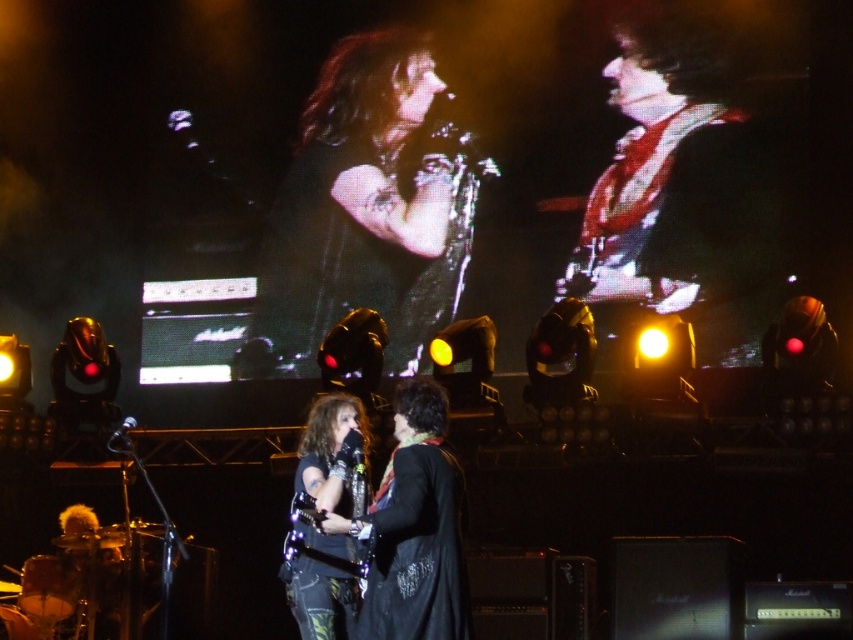
Does shiny black leather jacket at center have a lesser width compared to shiny red guitar at upper right?

No, shiny black leather jacket at center is not thinner than shiny red guitar at upper right.

Who is positioned more to the left, shiny black leather jacket at center or shiny red guitar at upper right?

Positioned to the left is shiny black leather jacket at center.

Is point (433, 230) closer to camera compared to point (621, 100)?

No, (433, 230) is further to viewer.

At what (x,y) coordinates should I click in order to perform the action: click on shiny black leather jacket at center. Please return your answer as a coordinate pair (x, y). This screenshot has height=640, width=853. Looking at the image, I should click on (364, 211).